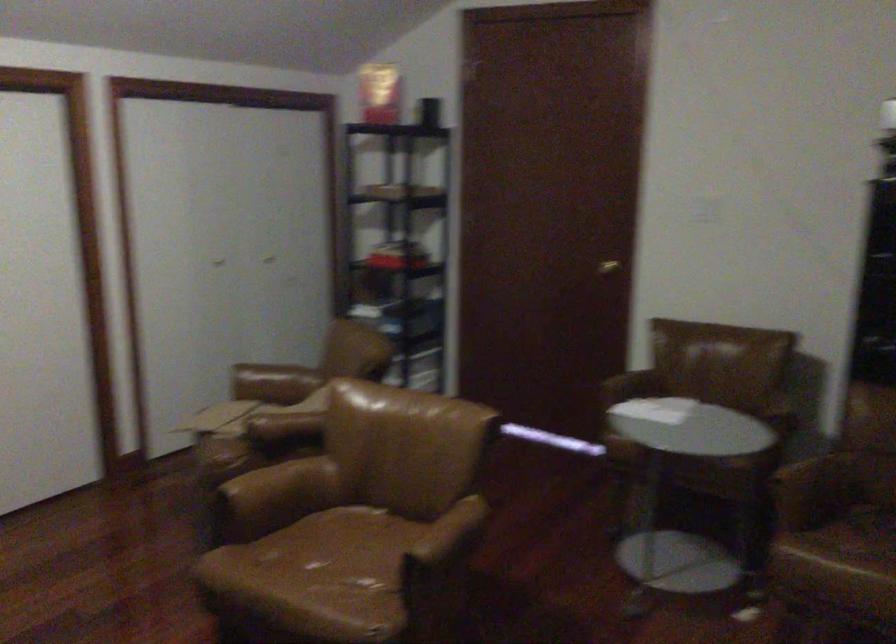
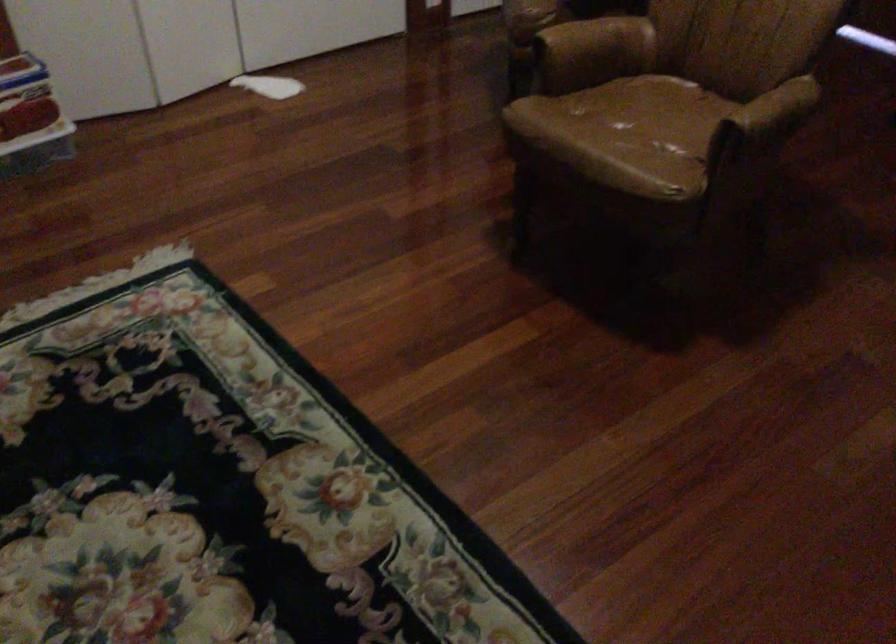
In the second image, find the point that corresponds to pixel 354 545 in the first image.

(661, 109)